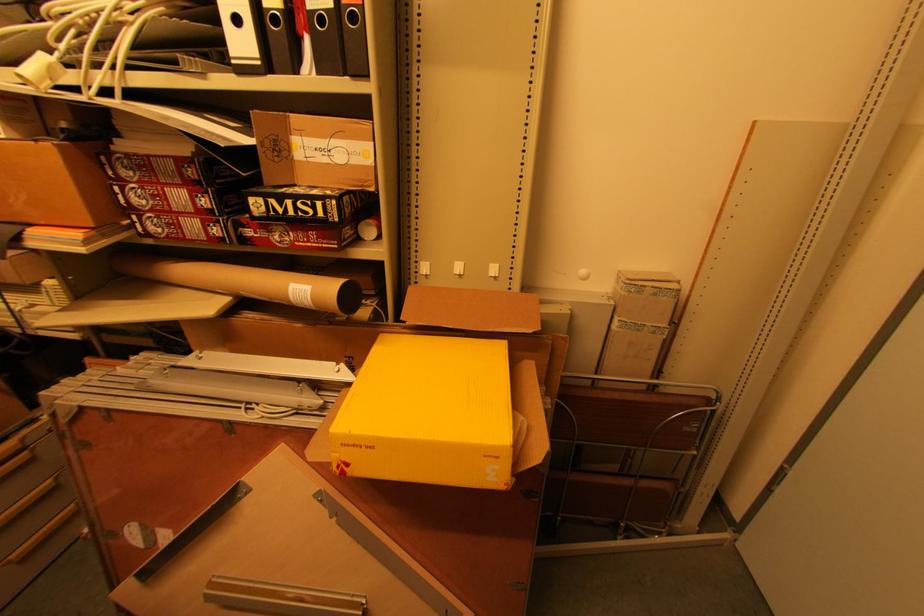
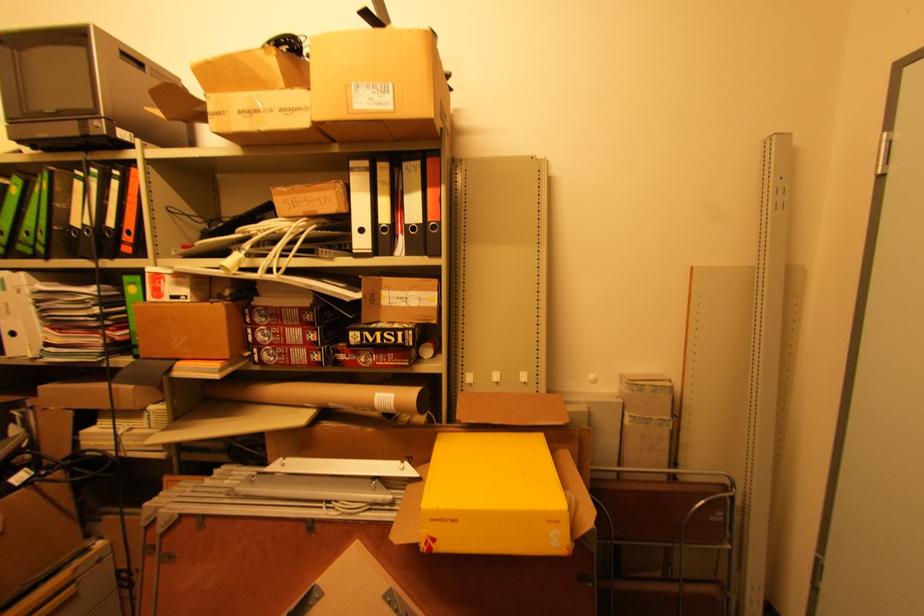
The images are taken continuously from a first-person perspective. In which direction are you moving?

The cameraman moved toward left, backward.